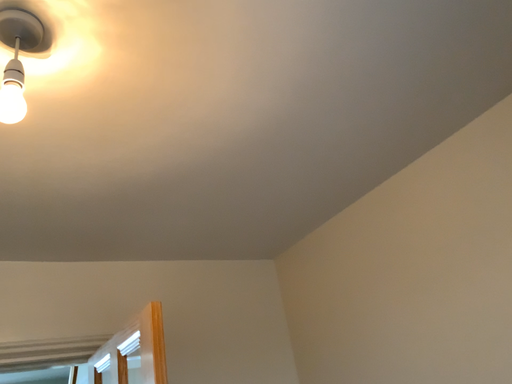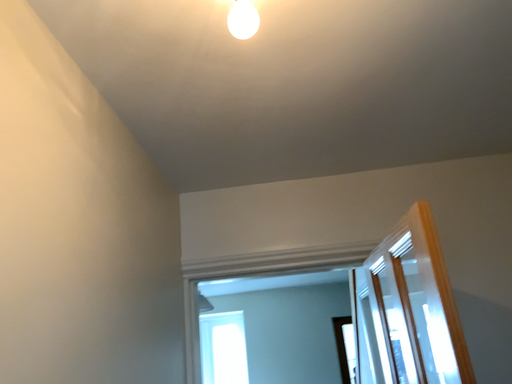
Question: How did the camera likely rotate when shooting the video?

Choices:
 (A) rotated downward
 (B) rotated upward

Answer: (A)